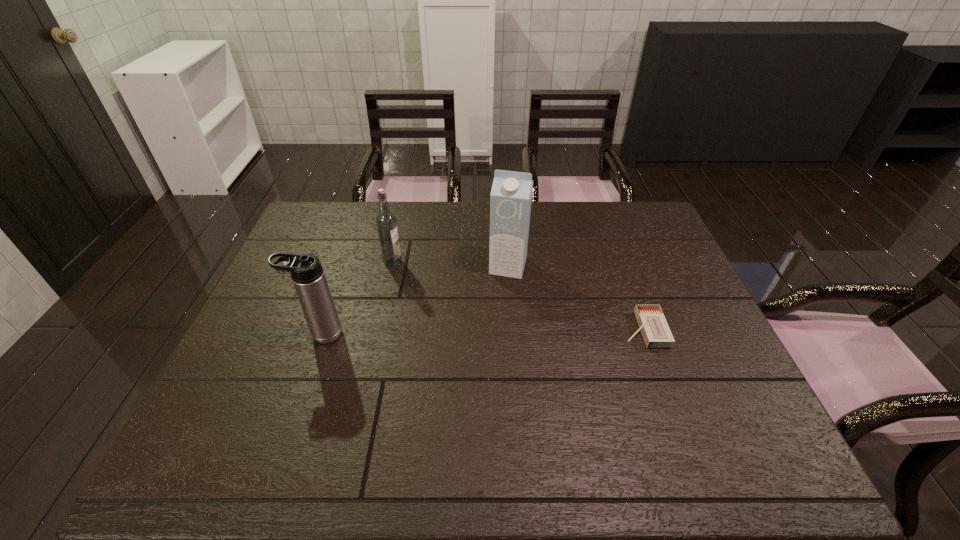
In the image, there is a desktop. Identify the location of vacant space at the far edge. Image resolution: width=960 pixels, height=540 pixels. (564, 205).

Where is `vacant area at the near edge of the desktop`? The height and width of the screenshot is (540, 960). vacant area at the near edge of the desktop is located at coordinates (442, 408).

The image size is (960, 540). What are the coordinates of `vacant area at the left edge` in the screenshot? It's located at (276, 269).

The image size is (960, 540). Find the location of `vacant area at the right edge of the desktop`. vacant area at the right edge of the desktop is located at coordinates (649, 259).

In the image, there is a desktop. At what (x,y) coordinates should I click in order to perform the action: click on vacant space at the far left corner. Please return your answer as a coordinate pair (x, y). Looking at the image, I should click on (340, 215).

Where is `vacant space at the near right corner of the desktop`? The image size is (960, 540). vacant space at the near right corner of the desktop is located at coordinates (752, 401).

Identify the location of empty location between the vodka and the leftmost object. (357, 298).

Locate an element on the screen. free space that is in between the tallest object and the shortest object is located at coordinates (576, 298).

Where is `free space between the shortest object and the vodka`? free space between the shortest object and the vodka is located at coordinates click(518, 296).

This screenshot has width=960, height=540. I want to click on empty space that is in between the carton and the vodka, so click(x=450, y=264).